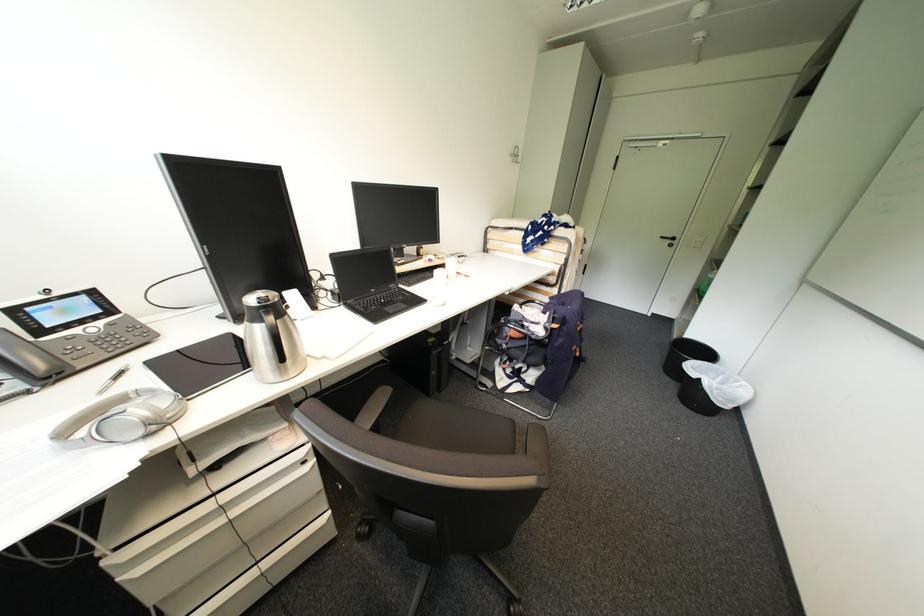
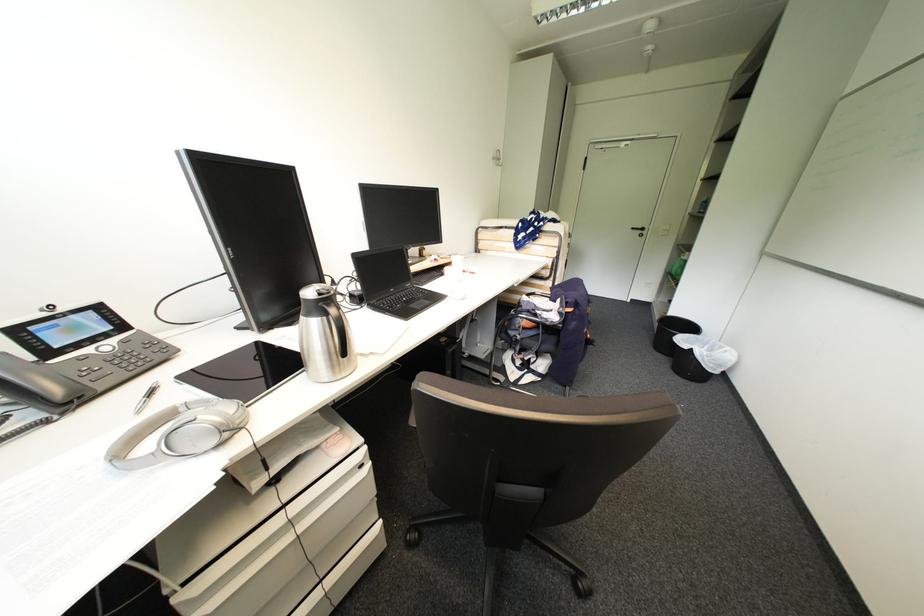
The point at (677,243) is marked in the first image. Where is the corresponding point in the second image?

(648, 233)